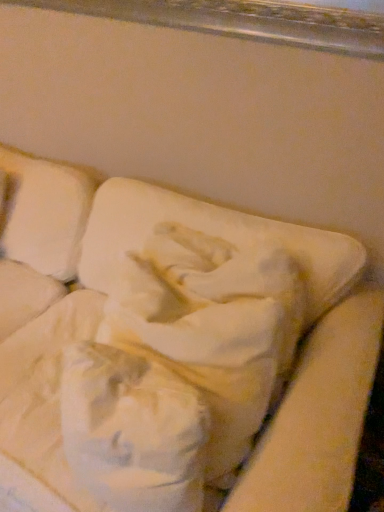
Find the location of a particular element. Image resolution: width=384 pixels, height=512 pixels. white fabric cushion at center is located at coordinates (145, 336).

Describe the element at coordinates (145, 336) in the screenshot. I see `white fabric cushion at center` at that location.

What do you see at coordinates (211, 234) in the screenshot? The width and height of the screenshot is (384, 512). I see `white soft pillow at center` at bounding box center [211, 234].

Locate an element on the screen. Image resolution: width=384 pixels, height=512 pixels. white soft pillow at center is located at coordinates (211, 234).

The width and height of the screenshot is (384, 512). I want to click on white fabric cushion at center, so click(145, 336).

Considering the positions of objects white fabric cushion at center and white soft pillow at center in the image provided, who is more to the right, white fabric cushion at center or white soft pillow at center?

white soft pillow at center is more to the right.

Considering their positions, is white fabric cushion at center located in front of or behind white soft pillow at center?

white fabric cushion at center is in front of white soft pillow at center.

Considering the points (143, 449) and (103, 209), which point is behind, point (143, 449) or point (103, 209)?

The point (103, 209) is more distant.

From the image's perspective, is white fabric cushion at center above white soft pillow at center?

Incorrect, from the image's perspective, white fabric cushion at center is lower than white soft pillow at center.

From a real-world perspective, is white fabric cushion at center on top of white soft pillow at center?

No, from a real-world perspective, white fabric cushion at center is not above white soft pillow at center.

In terms of width, does white fabric cushion at center look wider or thinner when compared to white soft pillow at center?

Considering their sizes, white fabric cushion at center looks broader than white soft pillow at center.

Who is shorter, white fabric cushion at center or white soft pillow at center?

white soft pillow at center.

Based on their sizes in the image, would you say white fabric cushion at center is bigger or smaller than white soft pillow at center?

white fabric cushion at center is bigger than white soft pillow at center.

Would you say white soft pillow at center is part of white fabric cushion at center's contents?

Yes, white soft pillow at center can be found within white fabric cushion at center.

Consider the image. Is white fabric cushion at center placed right next to white soft pillow at center?

There is a gap between white fabric cushion at center and white soft pillow at center.

Is white fabric cushion at center aimed at white soft pillow at center?

No, white fabric cushion at center does not turn towards white soft pillow at center.

How many degrees apart are the facing directions of white fabric cushion at center and white soft pillow at center?

white fabric cushion at center and white soft pillow at center are facing 4.19 degrees away from each other.

This screenshot has height=512, width=384. What are the coordinates of `pillow on the right of white fabric cushion at center` in the screenshot? It's located at (211, 234).

Is white soft pillow at center at the right side of white fabric cushion at center?

Indeed, white soft pillow at center is positioned on the right side of white fabric cushion at center.

Consider the image. Does white soft pillow at center come behind white fabric cushion at center?

Yes, white soft pillow at center is further from the viewer.

Which is in front, point (252, 218) or point (175, 242)?

Point (175, 242)

From the image's perspective, is white soft pillow at center beneath white fabric cushion at center?

No, from the image's perspective, white soft pillow at center is not beneath white fabric cushion at center.

From a real-world perspective, is white soft pillow at center under white fabric cushion at center?

No, from a real-world perspective, white soft pillow at center is not under white fabric cushion at center.

Does white soft pillow at center have a greater width compared to white fabric cushion at center?

No, white soft pillow at center is not wider than white fabric cushion at center.

Does white soft pillow at center have a lesser height compared to white fabric cushion at center?

Indeed, white soft pillow at center has a lesser height compared to white fabric cushion at center.

Can you confirm if white soft pillow at center is smaller than white fabric cushion at center?

Yes.

Do you think white soft pillow at center is within white fabric cushion at center, or outside of it?

white soft pillow at center exists entirely within white fabric cushion at center.

Are white soft pillow at center and white fabric cushion at center far apart?

Actually, white soft pillow at center and white fabric cushion at center are a little close together.

Is white soft pillow at center oriented away from white fabric cushion at center?

Yes, white soft pillow at center is positioned with its back facing white fabric cushion at center.

How different are the orientations of white soft pillow at center and white fabric cushion at center in degrees?

4.19 degrees.

Measure the distance between white soft pillow at center and white fabric cushion at center.

white soft pillow at center is 8.05 inches away from white fabric cushion at center.

What are the coordinates of `furniture below the white soft pillow at center (from a real-world perspective)` in the screenshot? It's located at (145, 336).

At what (x,y) coordinates should I click in order to perform the action: click on pillow above the white fabric cushion at center (from the image's perspective). Please return your answer as a coordinate pair (x, y). Looking at the image, I should click on (211, 234).

Where is `pillow on the right of the white fabric cushion at center`? This screenshot has height=512, width=384. pillow on the right of the white fabric cushion at center is located at coordinates (211, 234).